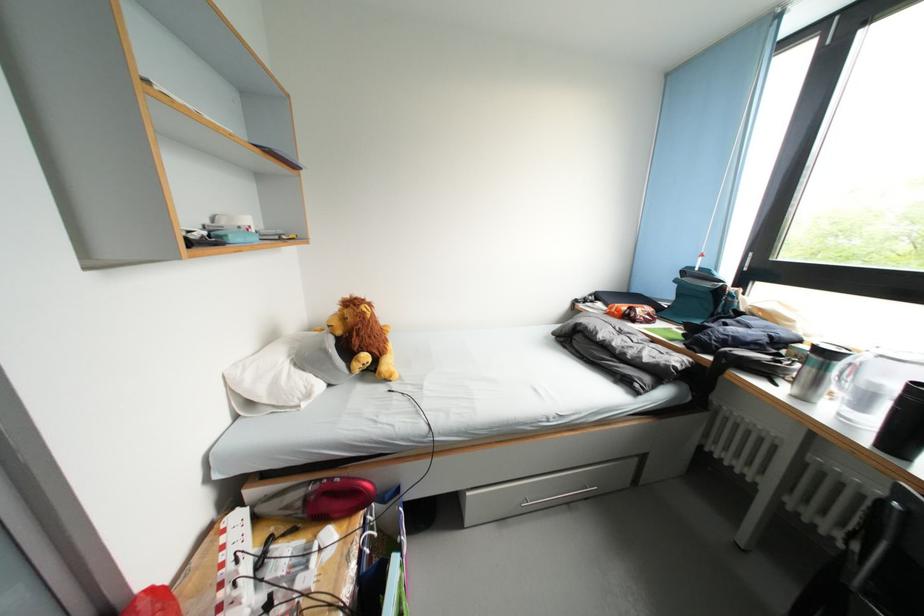
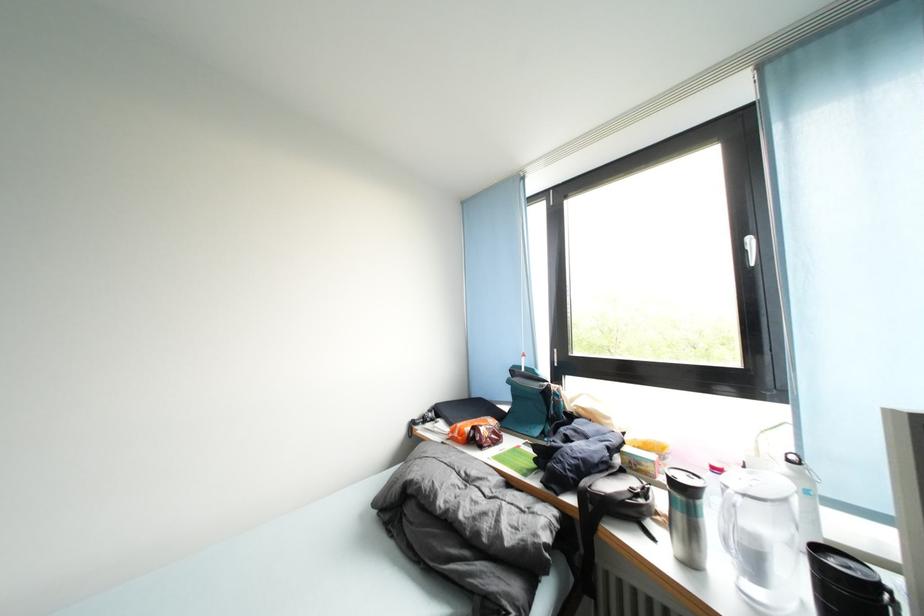
Locate, in the second image, the point that corresponds to [716,363] in the first image.

(579, 505)